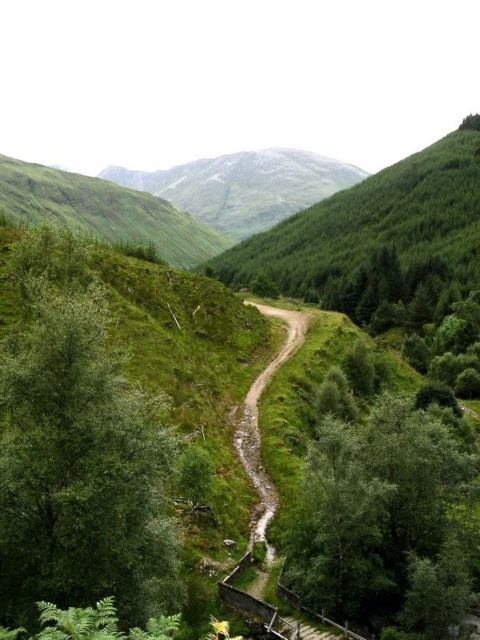
Question: In this image, where is green leafy tree at left located relative to green grassy mountain at upper center?

Choices:
 (A) right
 (B) left

Answer: (B)

Question: Is green leafy tree at left further to the viewer compared to green grassy mountain at upper center?

Choices:
 (A) no
 (B) yes

Answer: (A)

Question: Among these objects, which one is farthest from the camera?

Choices:
 (A) green leafy tree at left
 (B) green grassy mountain at upper center

Answer: (B)

Question: Is green leafy tree at left below green grassy mountain at upper center?

Choices:
 (A) no
 (B) yes

Answer: (B)

Question: Which point is closer to the camera taking this photo?

Choices:
 (A) (167, 179)
 (B) (128, 540)

Answer: (B)

Question: Which of the following is the closest to the observer?

Choices:
 (A) green grassy mountain at upper center
 (B) green leafy tree at left

Answer: (B)